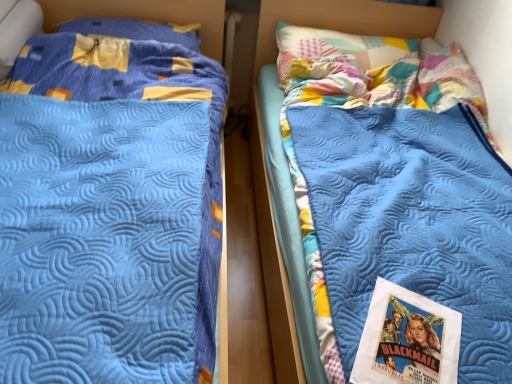
Question: Can you confirm if matte paper poster at lower right is smaller than blue quilted mattress at center?

Choices:
 (A) no
 (B) yes

Answer: (B)

Question: Is matte paper poster at lower right wider than blue quilted mattress at center?

Choices:
 (A) no
 (B) yes

Answer: (A)

Question: Is matte paper poster at lower right thinner than blue quilted mattress at center?

Choices:
 (A) no
 (B) yes

Answer: (B)

Question: Is matte paper poster at lower right facing away from blue quilted mattress at center?

Choices:
 (A) yes
 (B) no

Answer: (A)

Question: Does matte paper poster at lower right turn towards blue quilted mattress at center?

Choices:
 (A) no
 (B) yes

Answer: (B)

Question: Based on their sizes in the image, would you say blue quilted pillow at upper left is bigger or smaller than blue quilted bed at left?

Choices:
 (A) small
 (B) big

Answer: (A)

Question: Does point (91, 29) appear closer or farther from the camera than point (28, 26)?

Choices:
 (A) farther
 (B) closer

Answer: (A)

Question: Visually, is blue quilted pillow at upper left positioned to the left or to the right of blue quilted bed at left?

Choices:
 (A) left
 (B) right

Answer: (A)

Question: Considering the positions of blue quilted pillow at upper left and blue quilted bed at left in the image, is blue quilted pillow at upper left taller or shorter than blue quilted bed at left?

Choices:
 (A) tall
 (B) short

Answer: (B)

Question: From the image's perspective, is blue quilted mattress at center positioned above or below blue quilted bed at left?

Choices:
 (A) above
 (B) below

Answer: (B)

Question: Is blue quilted mattress at center to the left or to the right of blue quilted bed at left in the image?

Choices:
 (A) left
 (B) right

Answer: (B)

Question: Considering their positions, is blue quilted mattress at center located in front of or behind blue quilted bed at left?

Choices:
 (A) front
 (B) behind

Answer: (B)

Question: From a real-world perspective, is blue quilted mattress at center positioned above or below blue quilted bed at left?

Choices:
 (A) below
 (B) above

Answer: (A)

Question: Considering their positions, is blue quilted pillow at upper left located in front of or behind blue quilted mattress at center?

Choices:
 (A) behind
 (B) front

Answer: (A)

Question: Is blue quilted pillow at upper left to the left or to the right of blue quilted mattress at center in the image?

Choices:
 (A) left
 (B) right

Answer: (A)